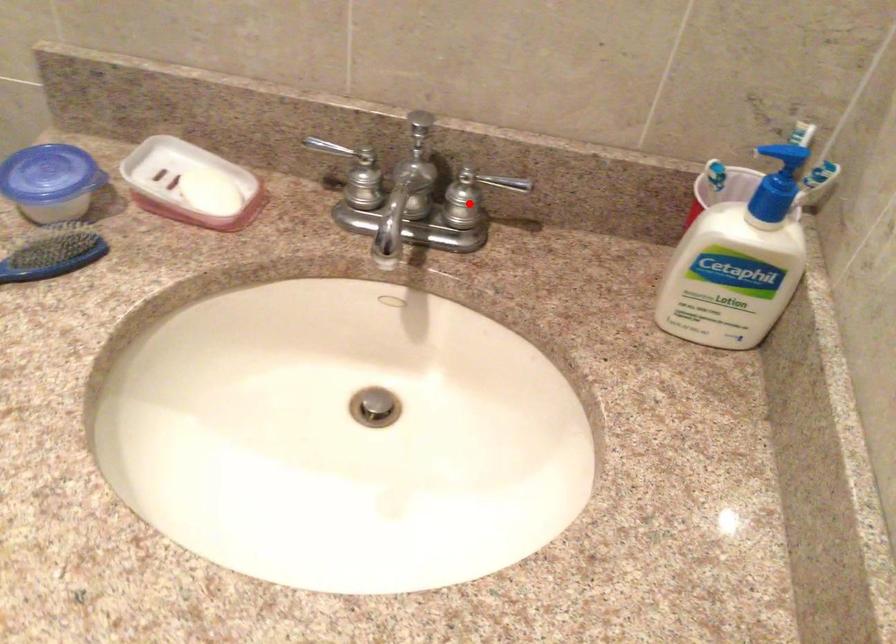
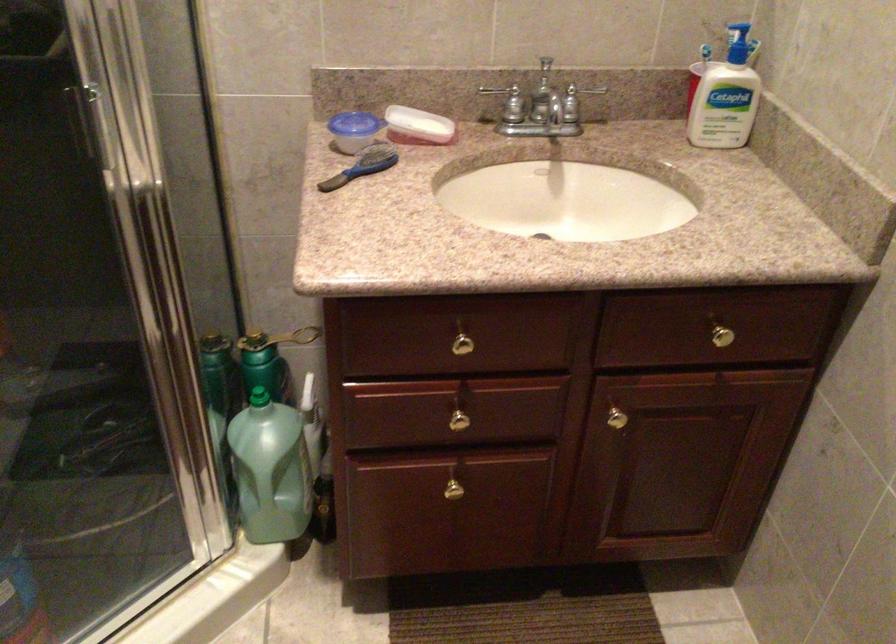
Question: I am providing you with two images of the same scene from different viewpoints. Given a red point in image1, look at the same physical point in image2. Is it:

Choices:
 (A) Closer to the viewpoint
 (B) Farther from the viewpoint

Answer: (B)